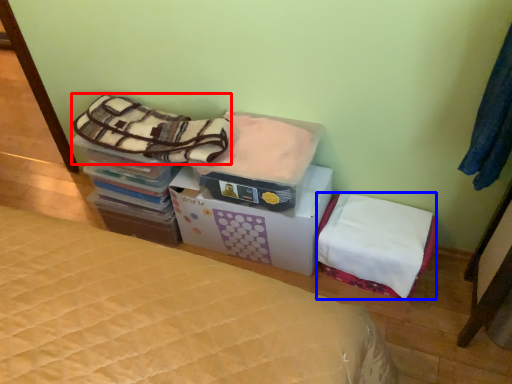
Question: Among these objects, which one is farthest to the camera, blanket (highlighted by a red box) or mattress (highlighted by a blue box)?

Choices:
 (A) blanket
 (B) mattress

Answer: (B)